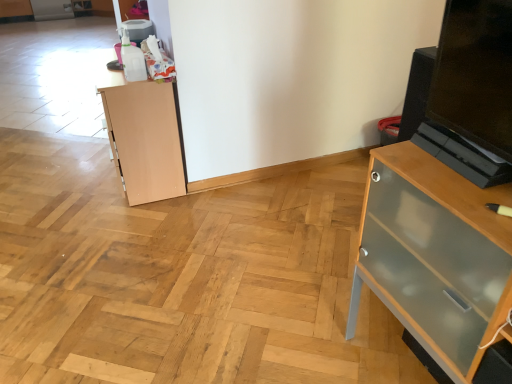
Question: From their relative heights in the image, would you say light brown wood cupboard at left is taller or shorter than clear glass cabinet at right?

Choices:
 (A) short
 (B) tall

Answer: (A)

Question: From the image's perspective, is light brown wood cupboard at left above or below clear glass cabinet at right?

Choices:
 (A) above
 (B) below

Answer: (A)

Question: Considering the positions of point (131, 152) and point (461, 235), is point (131, 152) closer or farther from the camera than point (461, 235)?

Choices:
 (A) farther
 (B) closer

Answer: (A)

Question: Is clear glass cabinet at right taller or shorter than light brown wood cupboard at left?

Choices:
 (A) tall
 (B) short

Answer: (A)

Question: Considering the relative positions of clear glass cabinet at right and light brown wood cupboard at left in the image provided, is clear glass cabinet at right to the left or to the right of light brown wood cupboard at left?

Choices:
 (A) left
 (B) right

Answer: (B)

Question: From a real-world perspective, is clear glass cabinet at right physically located above or below light brown wood cupboard at left?

Choices:
 (A) below
 (B) above

Answer: (B)

Question: In the image, is clear glass cabinet at right positioned in front of or behind light brown wood cupboard at left?

Choices:
 (A) behind
 (B) front

Answer: (B)